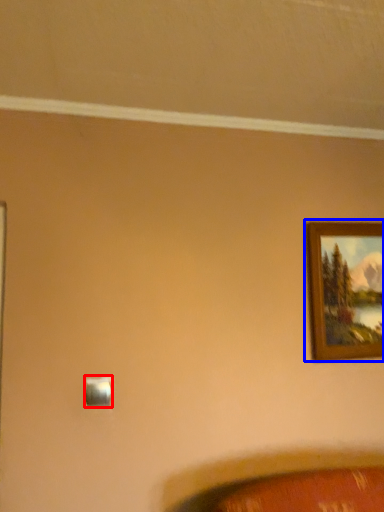
Question: Which object appears closest to the camera in this image, light switch (highlighted by a red box) or picture frame (highlighted by a blue box)?

Choices:
 (A) light switch
 (B) picture frame

Answer: (A)